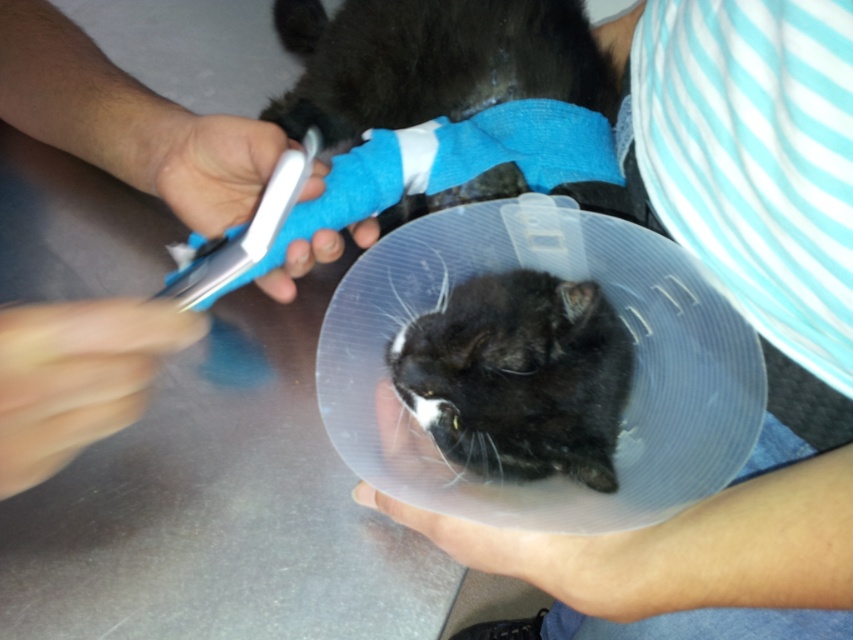
Question: Does blue striped shirt at upper right have a lesser width compared to smooth blue bandage at upper center?

Choices:
 (A) yes
 (B) no

Answer: (B)

Question: Estimate the real-world distances between objects in this image. Which object is farther from the smooth blue bandage at upper center?

Choices:
 (A) blue striped shirt at upper right
 (B) black matte cone at center

Answer: (A)

Question: Estimate the real-world distances between objects in this image. Which object is closer to the black matte cone at center?

Choices:
 (A) blue striped shirt at upper right
 (B) smooth blue bandage at upper center

Answer: (A)

Question: Estimate the real-world distances between objects in this image. Which object is closer to the blue striped shirt at upper right?

Choices:
 (A) black matte cone at center
 (B) smooth blue bandage at upper center

Answer: (A)

Question: Is smooth blue bandage at upper center smaller than black matte cone at center?

Choices:
 (A) yes
 (B) no

Answer: (B)

Question: Can you confirm if blue striped shirt at upper right is positioned to the left of black matte cone at center?

Choices:
 (A) yes
 (B) no

Answer: (B)